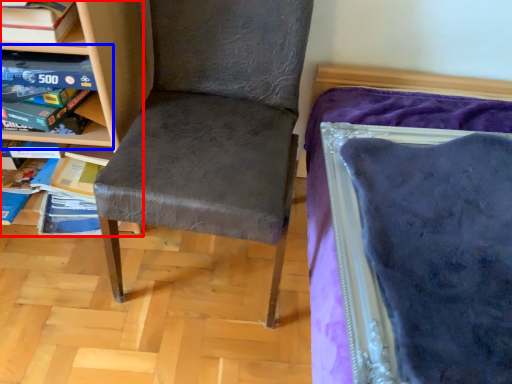
Question: Which point is closer to the camera, shelf (highlighted by a red box) or shelf (highlighted by a blue box)?

Choices:
 (A) shelf
 (B) shelf

Answer: (A)